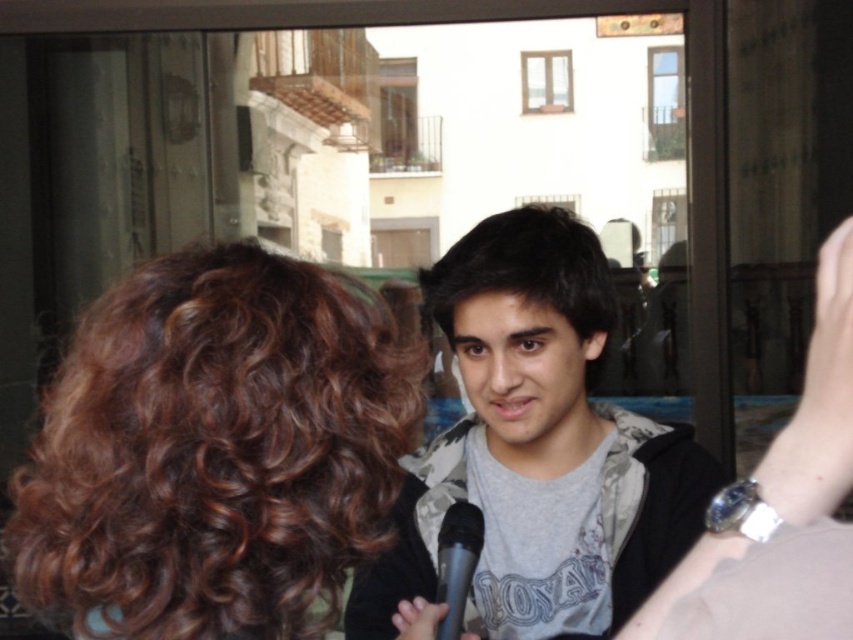
Does curly hair at center appear on the right side of dark brown hair at center?

In fact, curly hair at center is to the left of dark brown hair at center.

The height and width of the screenshot is (640, 853). What are the coordinates of `curly hair at center` in the screenshot? It's located at (213, 451).

Find the location of a particular element. Image resolution: width=853 pixels, height=640 pixels. curly hair at center is located at coordinates (213, 451).

Who is lower down, gray cotton shirt at center or dark brown hair at center?

gray cotton shirt at center is lower down.

Can you confirm if gray cotton shirt at center is wider than dark brown hair at center?

Indeed, gray cotton shirt at center has a greater width compared to dark brown hair at center.

Where is `gray cotton shirt at center`? gray cotton shirt at center is located at coordinates (537, 449).

At what (x,y) coordinates should I click in order to perform the action: click on gray cotton shirt at center. Please return your answer as a coordinate pair (x, y). Image resolution: width=853 pixels, height=640 pixels. Looking at the image, I should click on (537, 449).

Who is more distant from viewer, (190,547) or (502,310)?

The point (502,310) is behind.

Which is in front, point (146, 424) or point (556, 538)?

Point (146, 424) is in front.

You are a GUI agent. You are given a task and a screenshot of the screen. Output one action in this format:
    pyautogui.click(x=<x>, y=<y>)
    Task: Click on the curly hair at center
    
    Given the screenshot: What is the action you would take?
    pyautogui.click(x=213, y=451)